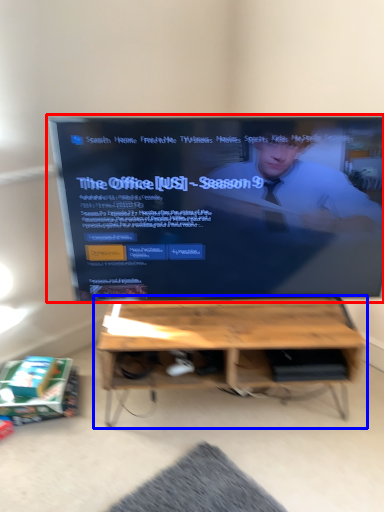
Question: Which point is further to the camera, television (highlighted by a red box) or table (highlighted by a blue box)?

Choices:
 (A) television
 (B) table

Answer: (B)